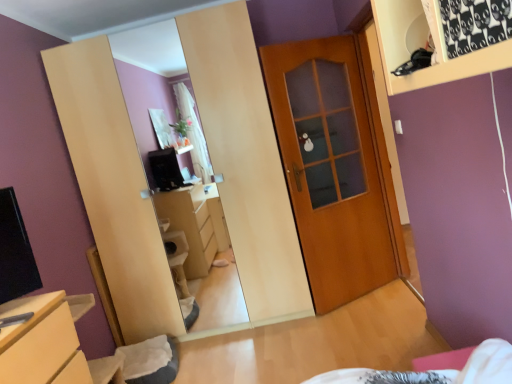
Question: Is black fabric at upper right a part of wooden door at center?

Choices:
 (A) no
 (B) yes

Answer: (A)

Question: Considering the relative positions of wooden door at center and black fabric at upper right in the image provided, is wooden door at center to the left of black fabric at upper right from the viewer's perspective?

Choices:
 (A) yes
 (B) no

Answer: (B)

Question: Is wooden door at center far from black fabric at upper right?

Choices:
 (A) yes
 (B) no

Answer: (A)

Question: Is wooden door at center thinner than black fabric at upper right?

Choices:
 (A) no
 (B) yes

Answer: (B)

Question: Is wooden door at center positioned with its back to black fabric at upper right?

Choices:
 (A) yes
 (B) no

Answer: (B)

Question: From the image's perspective, is matte wood chest of drawers at lower left located above or below wooden door at center?

Choices:
 (A) above
 (B) below

Answer: (B)

Question: In terms of size, does matte wood chest of drawers at lower left appear bigger or smaller than wooden door at center?

Choices:
 (A) big
 (B) small

Answer: (A)

Question: Choose the correct answer: Is matte wood chest of drawers at lower left inside wooden door at center or outside it?

Choices:
 (A) outside
 (B) inside

Answer: (A)

Question: Is point (42, 367) closer or farther from the camera than point (332, 291)?

Choices:
 (A) closer
 (B) farther

Answer: (A)

Question: Based on their sizes in the image, would you say wooden door at center is bigger or smaller than black fabric at upper right?

Choices:
 (A) small
 (B) big

Answer: (B)

Question: From a real-world perspective, relative to black fabric at upper right, is wooden door at center vertically above or below?

Choices:
 (A) above
 (B) below

Answer: (B)

Question: Would you say wooden door at center is inside or outside black fabric at upper right?

Choices:
 (A) outside
 (B) inside

Answer: (A)

Question: Considering the positions of wooden door at center and black fabric at upper right in the image, is wooden door at center taller or shorter than black fabric at upper right?

Choices:
 (A) tall
 (B) short

Answer: (A)

Question: Considering the positions of black fabric at upper right and matte wood chest of drawers at lower left in the image, is black fabric at upper right taller or shorter than matte wood chest of drawers at lower left?

Choices:
 (A) short
 (B) tall

Answer: (A)

Question: Is point (425, 36) positioned closer to the camera than point (10, 327)?

Choices:
 (A) farther
 (B) closer

Answer: (B)